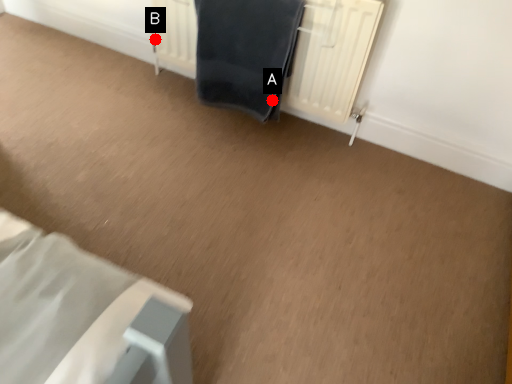
Question: Two points are circled on the image, labeled by A and B beside each circle. Which point appears farthest from the camera in this image?

Choices:
 (A) A is further
 (B) B is further

Answer: (B)